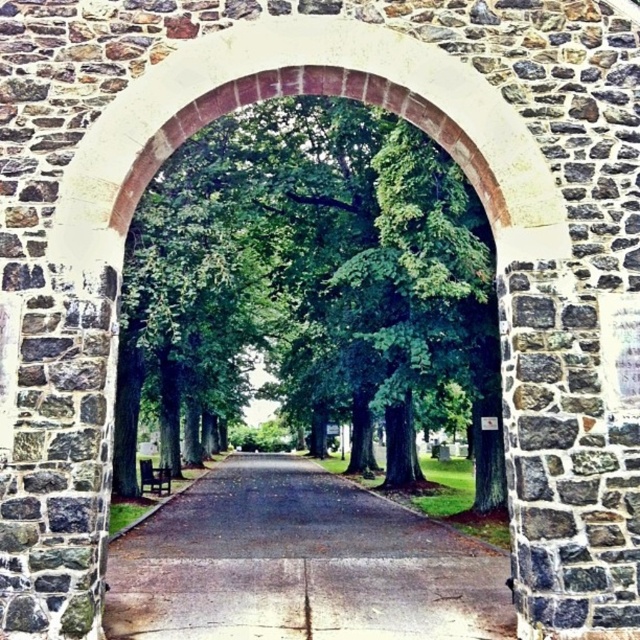
Question: Which of the following is the farthest from the observer?

Choices:
 (A) dark asphalt road at center
 (B) green leafy tree at center

Answer: (B)

Question: Which object appears farthest from the camera in this image?

Choices:
 (A) dark asphalt road at center
 (B) green leafy tree at center

Answer: (B)

Question: Does green leafy tree at center appear on the left side of dark asphalt road at center?

Choices:
 (A) yes
 (B) no

Answer: (B)

Question: Does green leafy tree at center have a lesser width compared to dark asphalt road at center?

Choices:
 (A) yes
 (B) no

Answer: (B)

Question: Which point is closer to the camera?

Choices:
 (A) green leafy tree at center
 (B) dark asphalt road at center

Answer: (B)

Question: Considering the relative positions of green leafy tree at center and dark asphalt road at center in the image provided, where is green leafy tree at center located with respect to dark asphalt road at center?

Choices:
 (A) above
 (B) below

Answer: (A)